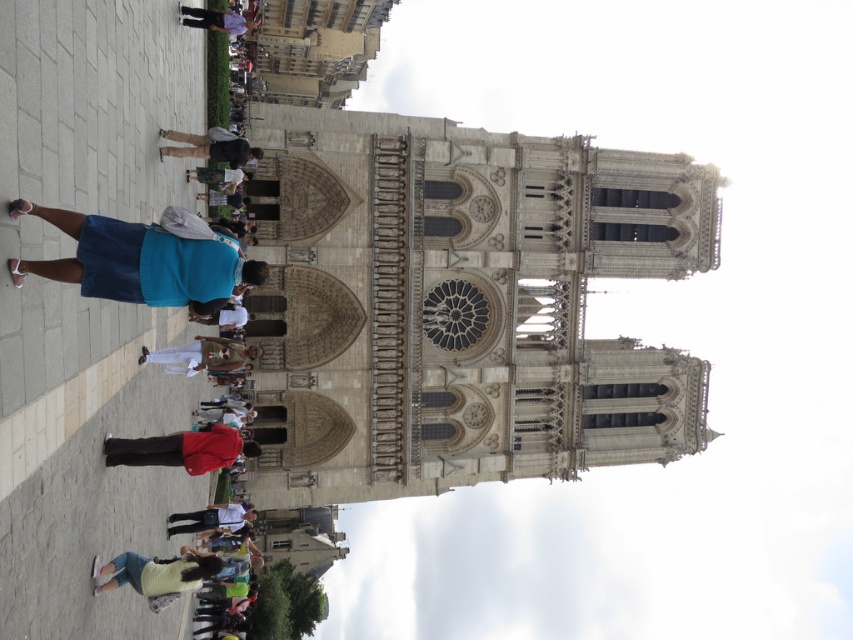
You are standing in the square in front of the cathedral and see two people wearing a red cotton shirt at center and a white shirt at center. Which one is positioned more to the right?

The red cotton shirt at center is positioned more to the right than the white shirt at center.